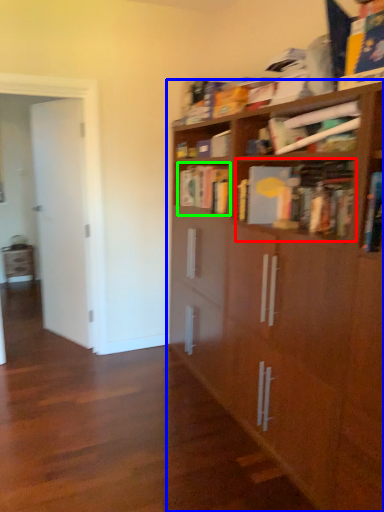
Question: Estimate the real-world distances between objects in this image. Which object is farther from book (highlighted by a red box), bookcase (highlighted by a blue box) or book (highlighted by a green box)?

Choices:
 (A) bookcase
 (B) book

Answer: (B)